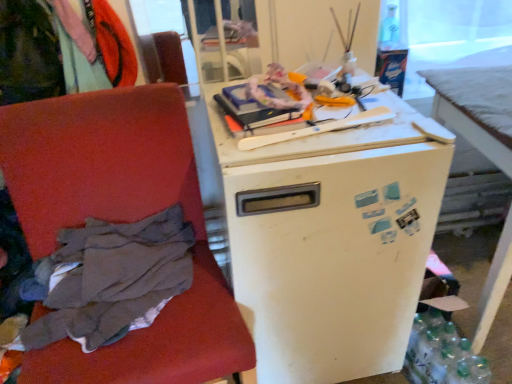
Question: Is clear plastic bottles at lower right further to the viewer compared to white matte refrigerator at center?

Choices:
 (A) no
 (B) yes

Answer: (B)

Question: Is clear plastic bottles at lower right wider than white matte refrigerator at center?

Choices:
 (A) yes
 (B) no

Answer: (B)

Question: Does clear plastic bottles at lower right have a greater height compared to white matte refrigerator at center?

Choices:
 (A) no
 (B) yes

Answer: (A)

Question: Could you tell me if clear plastic bottles at lower right is turned towards white matte refrigerator at center?

Choices:
 (A) no
 (B) yes

Answer: (A)

Question: Does clear plastic bottles at lower right have a lesser width compared to white matte refrigerator at center?

Choices:
 (A) yes
 (B) no

Answer: (A)

Question: From a real-world perspective, is clear plastic bottles at lower right on top of white matte refrigerator at center?

Choices:
 (A) no
 (B) yes

Answer: (A)

Question: Can you confirm if clear plastic bottles at lower right is smaller than white matte desk at right?

Choices:
 (A) no
 (B) yes

Answer: (B)

Question: From the image's perspective, is clear plastic bottles at lower right on top of white matte desk at right?

Choices:
 (A) yes
 (B) no

Answer: (B)

Question: Is clear plastic bottles at lower right to the left of white matte desk at right from the viewer's perspective?

Choices:
 (A) no
 (B) yes

Answer: (B)

Question: Considering the relative sizes of clear plastic bottles at lower right and white matte desk at right in the image provided, is clear plastic bottles at lower right bigger than white matte desk at right?

Choices:
 (A) yes
 (B) no

Answer: (B)

Question: Is clear plastic bottles at lower right thinner than white matte desk at right?

Choices:
 (A) yes
 (B) no

Answer: (A)

Question: Is white matte desk at right at the back of clear plastic bottles at lower right?

Choices:
 (A) yes
 (B) no

Answer: (B)

Question: Can we say dark gray fabric at left, the 1th clothing positioned from the right, lies outside white matte desk at right?

Choices:
 (A) yes
 (B) no

Answer: (A)